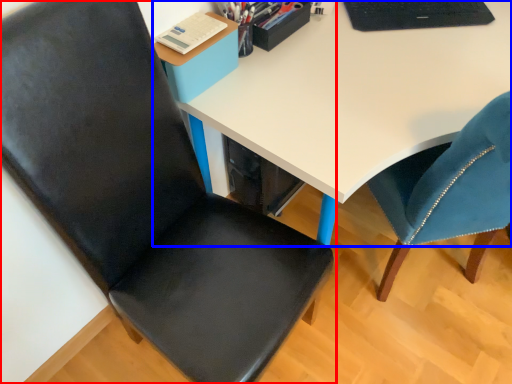
Question: Among these objects, which one is farthest to the camera, chair (highlighted by a red box) or desk (highlighted by a blue box)?

Choices:
 (A) chair
 (B) desk

Answer: (B)